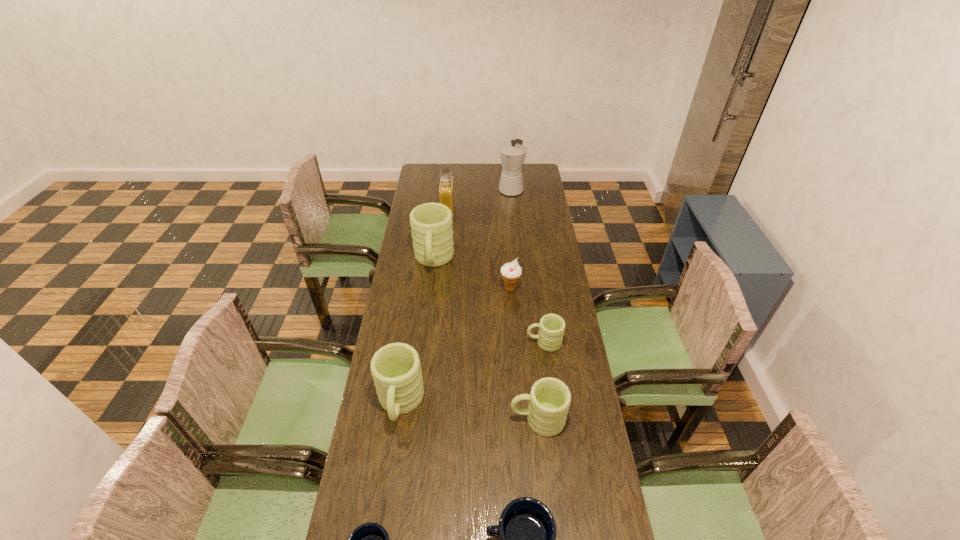
Image resolution: width=960 pixels, height=540 pixels. What are the coordinates of `green mug that is the second closest to the third farthest object` in the screenshot? It's located at (396, 370).

You are a GUI agent. You are given a task and a screenshot of the screen. Output one action in this format:
    pyautogui.click(x=<x>, y=<y>)
    Task: Click on the vacant area that satisfies the following two spatial constraints: 1. on the side of the white icecream with the handle; 2. on the right side of the third farthest object
    This screenshot has height=540, width=960.
    Given the screenshot: What is the action you would take?
    pyautogui.click(x=430, y=289)

Image resolution: width=960 pixels, height=540 pixels. Find the location of `free location that satisfies the following two spatial constraints: 1. on the side of the seventh tallest object with the handle; 2. on the side of the second biggest green mug with the handle`. free location that satisfies the following two spatial constraints: 1. on the side of the seventh tallest object with the handle; 2. on the side of the second biggest green mug with the handle is located at coordinates (552, 404).